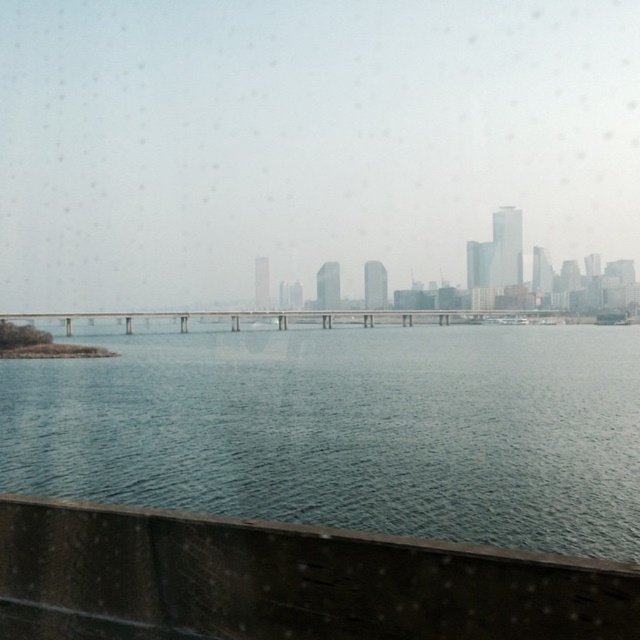
Is point (298, 458) positioned after point (467, 317)?

No, it is not.

You are a GUI agent. You are given a task and a screenshot of the screen. Output one action in this format:
    pyautogui.click(x=<x>, y=<y>)
    Task: Click on the blue water at center
    This screenshot has height=640, width=640.
    Given the screenshot: What is the action you would take?
    pyautogui.click(x=346, y=429)

Locate an element on the screen. The width and height of the screenshot is (640, 640). blue water at center is located at coordinates (346, 429).